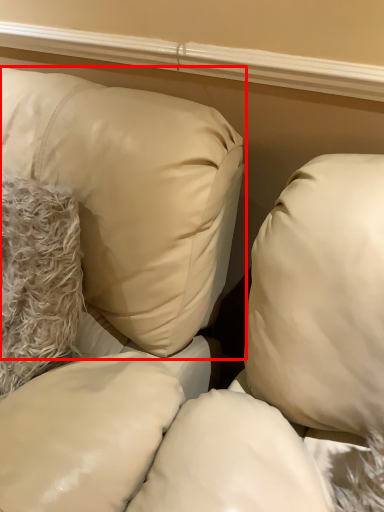
Question: In this image, where is pillow (annotated by the red box) located relative to pillow?

Choices:
 (A) left
 (B) right

Answer: (A)